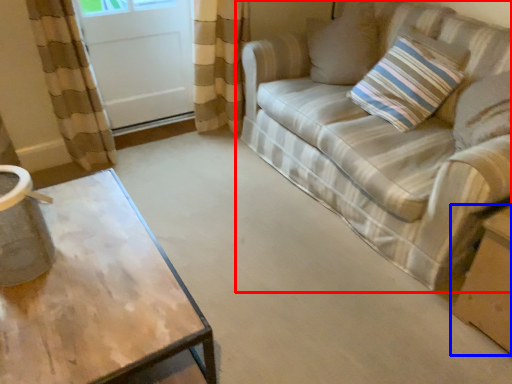
Question: Which of the following is the farthest to the observer, studio couch (highlighted by a red box) or cardboard box (highlighted by a blue box)?

Choices:
 (A) studio couch
 (B) cardboard box

Answer: (B)